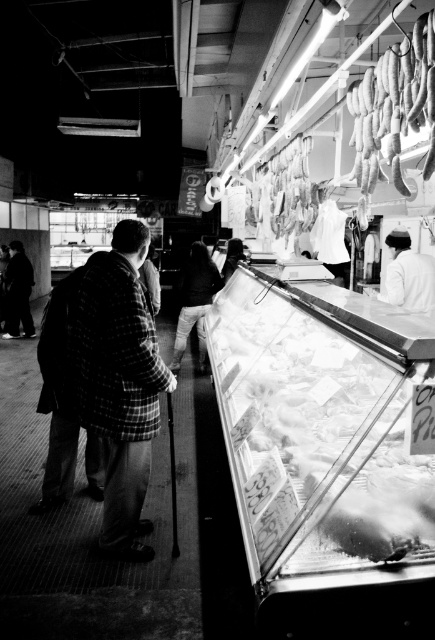
Question: Which is nearer to the smooth white sausage at upper right?

Choices:
 (A) white cotton shirt at upper right
 (B) dark clothing at left
 (C) translucent plastic tray at center
 (D) shiny silver meat at upper center

Answer: (C)

Question: Is shiny silver meat at upper center to the left of dark clothing at left from the viewer's perspective?

Choices:
 (A) yes
 (B) no

Answer: (B)

Question: Is translucent plastic tray at center to the left of dark plaid shirt at center from the viewer's perspective?

Choices:
 (A) no
 (B) yes

Answer: (A)

Question: Which point is closer to the camera?

Choices:
 (A) dark clothing at left
 (B) white cotton shirt at upper right

Answer: (B)

Question: Considering the relative positions of translucent plastic tray at center and white cotton shirt at upper right in the image provided, where is translucent plastic tray at center located with respect to white cotton shirt at upper right?

Choices:
 (A) left
 (B) right

Answer: (A)

Question: Which of the following is the farthest from the observer?

Choices:
 (A) (217, 289)
 (B) (257, 236)
 (C) (387, 275)

Answer: (B)